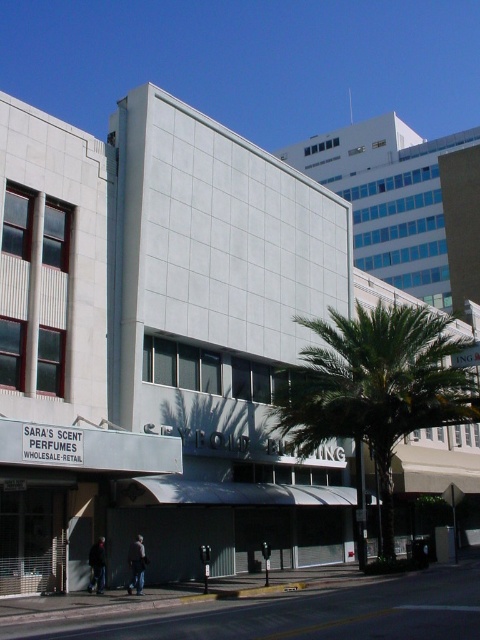
You are standing on the sidewalk in front of the building and see the dark gray jacket at lower center. If you walk straight towards the building entrance, will the palm tree block your path to the jacket?

The palm tree is in front of the building, while the dark gray jacket at lower center is located at point [136,564]. Since the jacket is at lower center, it is likely positioned near the sidewalk where you are standing, so the palm tree would not block your path to the jacket.

You are standing on the sidewalk in front of the building and want to take a photo of the perfume store sign. To avoid the palm tree blocking your view, where should you position yourself relative to the green leafy palm tree at center?

The green leafy palm tree at center is located at point (x=375, y=388). To avoid the tree blocking the view of the perfume store sign, you should position yourself to the left or right of the tree, ensuring it is not directly in front of the sign.

You are a delivery person who needs to deliver a package to the perfume store. You see the green leafy palm tree at center and the dark gray jacket at lower center. Which object is bigger in size?

The green leafy palm tree at center is larger in size compared to the dark gray jacket at lower center.